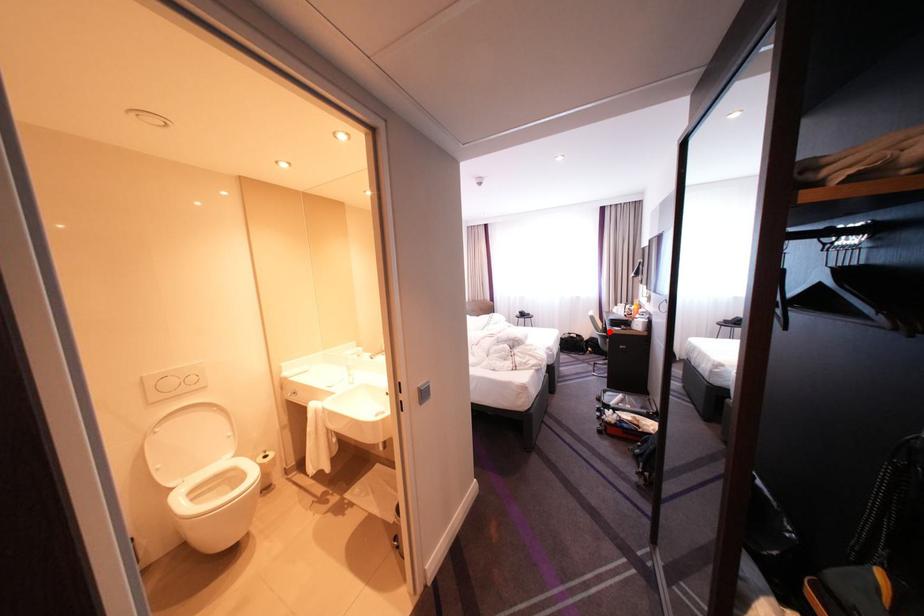
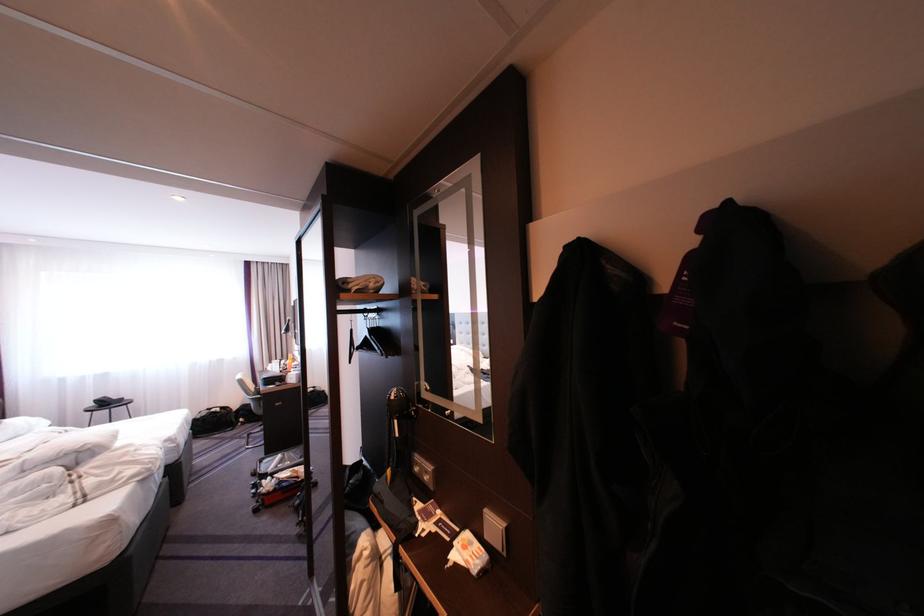
Question: A red point is marked in image1. In image2, is the corresponding 3D point closer to the camera or farther? Reply with the corresponding letter.

Choices:
 (A) The corresponding 3D point is closer.
 (B) The corresponding 3D point is farther.

Answer: (B)